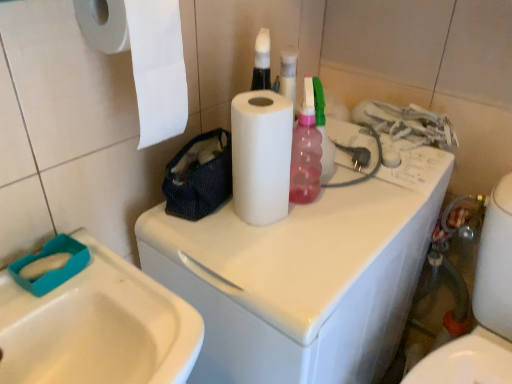
Question: Is white glossy washing machine at center beside white glossy sink at lower left?

Choices:
 (A) yes
 (B) no

Answer: (B)

Question: Can you confirm if white glossy washing machine at center is bigger than white glossy sink at lower left?

Choices:
 (A) yes
 (B) no

Answer: (A)

Question: From a real-world perspective, is white glossy washing machine at center below white glossy sink at lower left?

Choices:
 (A) yes
 (B) no

Answer: (A)

Question: Considering the relative sizes of white glossy washing machine at center and white glossy sink at lower left in the image provided, is white glossy washing machine at center shorter than white glossy sink at lower left?

Choices:
 (A) yes
 (B) no

Answer: (B)

Question: Is the depth of white glossy washing machine at center less than that of white glossy sink at lower left?

Choices:
 (A) no
 (B) yes

Answer: (A)

Question: Considering the relative sizes of white glossy washing machine at center and white glossy sink at lower left in the image provided, is white glossy washing machine at center smaller than white glossy sink at lower left?

Choices:
 (A) no
 (B) yes

Answer: (A)

Question: Is white glossy toilet at lower right not inside white paper at upper left, marked as the 2th paper towel in a right-to-left arrangement?

Choices:
 (A) no
 (B) yes

Answer: (B)

Question: Does white glossy toilet at lower right have a greater height compared to white paper at upper left, which is the first paper towel in left-to-right order?

Choices:
 (A) yes
 (B) no

Answer: (A)

Question: Can you confirm if white glossy toilet at lower right is positioned to the right of white paper at upper left, marked as the 2th paper towel in a right-to-left arrangement?

Choices:
 (A) no
 (B) yes

Answer: (B)

Question: Is white glossy toilet at lower right positioned with its back to white paper at upper left, marked as the 2th paper towel in a right-to-left arrangement?

Choices:
 (A) yes
 (B) no

Answer: (B)

Question: Does white glossy toilet at lower right lie in front of white paper at upper left, which is the first paper towel in left-to-right order?

Choices:
 (A) no
 (B) yes

Answer: (A)

Question: Considering the relative sizes of white glossy toilet at lower right and white paper at upper left, marked as the 2th paper towel in a right-to-left arrangement, in the image provided, is white glossy toilet at lower right shorter than white paper at upper left, marked as the 2th paper towel in a right-to-left arrangement,?

Choices:
 (A) no
 (B) yes

Answer: (A)

Question: Can you confirm if white glossy sink at lower left is thinner than white paper at upper left, which is the first paper towel in left-to-right order?

Choices:
 (A) no
 (B) yes

Answer: (A)